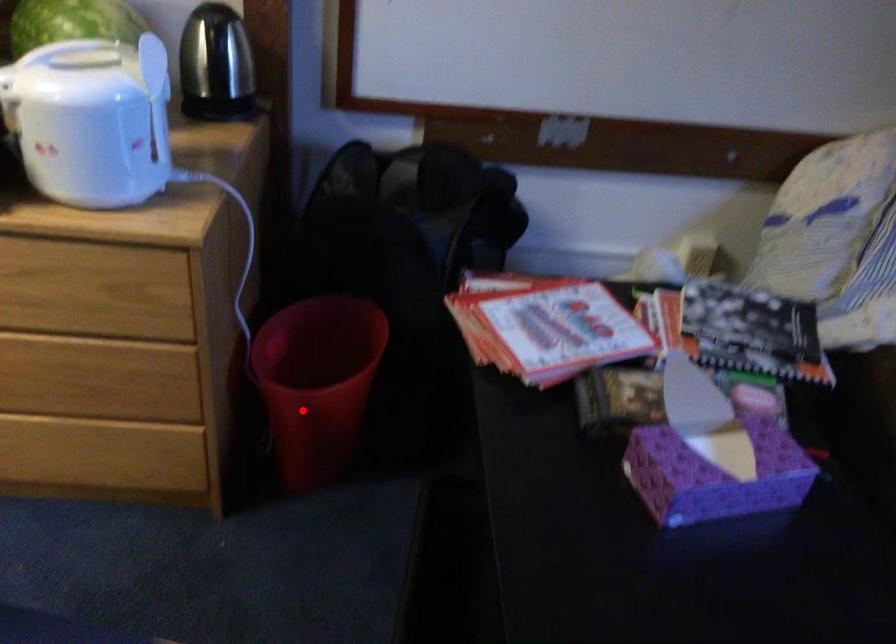
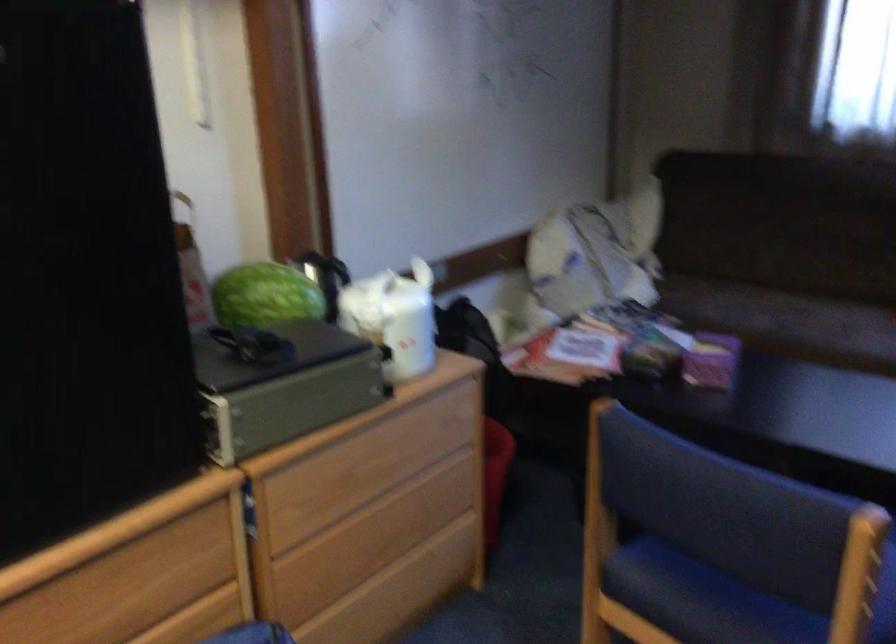
Question: I am providing you with two images of the same scene from different viewpoints. A red point is shown in image1. For the corresponding object point in image2, is it positioned nearer or farther from the camera?

Choices:
 (A) Nearer
 (B) Farther

Answer: (B)